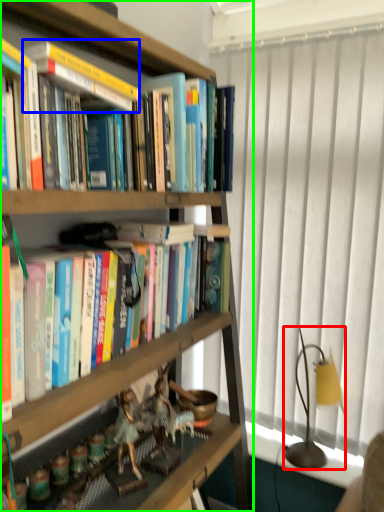
Question: Which object is the farthest from lamp (highlighted by a red box)? Choose among these: paperback book (highlighted by a blue box) or bookcase (highlighted by a green box).

Choices:
 (A) paperback book
 (B) bookcase

Answer: (B)